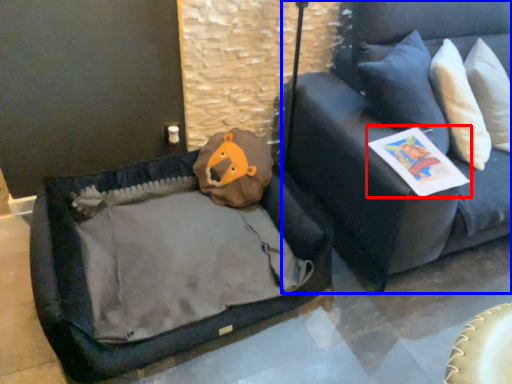
Question: Which object appears farthest to the camera in this image, magazine (highlighted by a red box) or studio couch (highlighted by a blue box)?

Choices:
 (A) magazine
 (B) studio couch

Answer: (A)